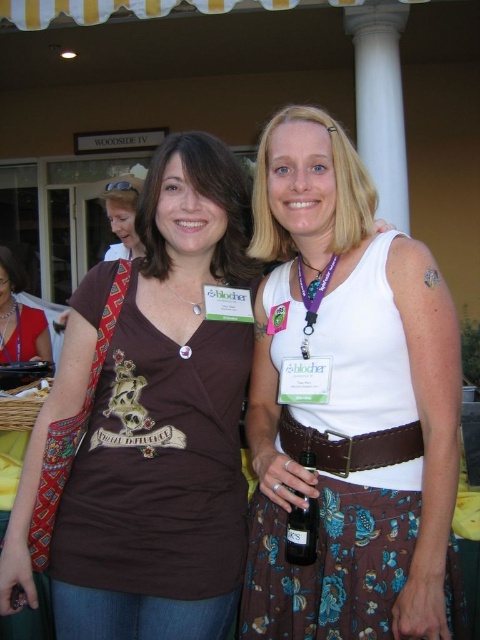
Who is shorter, white matte tank top at center or purple fabric lanyard at center?

Standing shorter between the two is purple fabric lanyard at center.

You are a GUI agent. You are given a task and a screenshot of the screen. Output one action in this format:
    pyautogui.click(x=<x>, y=<y>)
    Task: Click on the white matte tank top at center
    
    Given the screenshot: What is the action you would take?
    pyautogui.click(x=349, y=404)

Which is in front, point (408, 266) or point (12, 582)?

Point (408, 266)

From the picture: Who is more forward, (257, 598) or (60, 362)?

Point (257, 598)

At what (x,y) coordinates should I click in order to perform the action: click on white matte tank top at center. Please return your answer as a coordinate pair (x, y). The image size is (480, 640). Looking at the image, I should click on (349, 404).

Which of these two, brown fabric shirt at center or matte black laptop at left, stands taller?

brown fabric shirt at center is taller.

Does brown fabric shirt at center appear over matte black laptop at left?

Actually, brown fabric shirt at center is below matte black laptop at left.

Is point (96, 465) more distant than point (1, 360)?

No, (96, 465) is in front of (1, 360).

You are a GUI agent. You are given a task and a screenshot of the screen. Output one action in this format:
    pyautogui.click(x=<x>, y=<y>)
    Task: Click on the brown fabric shirt at center
    
    Given the screenshot: What is the action you would take?
    (167, 420)